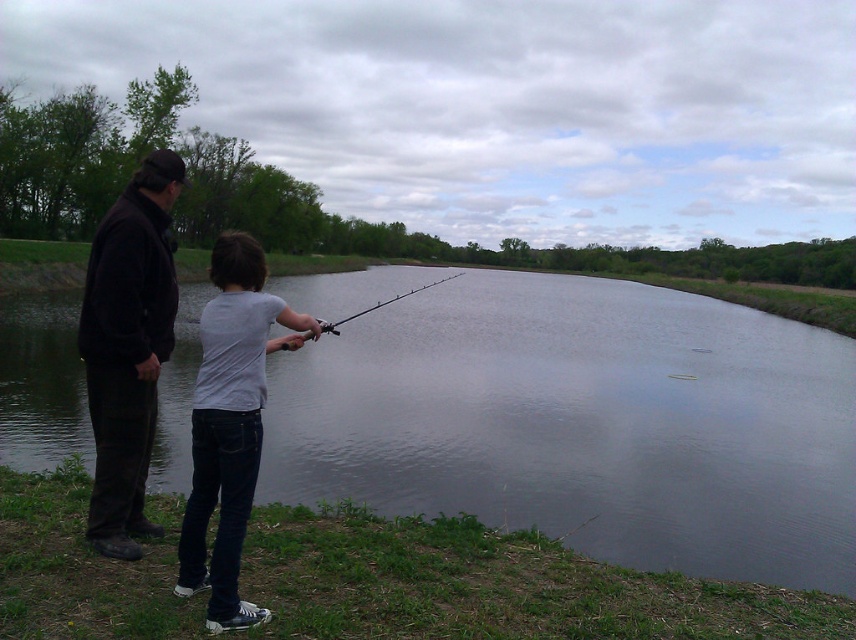
Question: Can you confirm if dark brown leather jacket at left is positioned above white matte shirt at center?

Choices:
 (A) yes
 (B) no

Answer: (A)

Question: Is clear water at center further to camera compared to smooth black rod at center?

Choices:
 (A) no
 (B) yes

Answer: (A)

Question: Which point is farther from the camera taking this photo?

Choices:
 (A) (284, 342)
 (B) (266, 476)

Answer: (B)

Question: Among these points, which one is farthest from the camera?

Choices:
 (A) (397, 296)
 (B) (232, 525)
 (C) (801, 444)
 (D) (141, 275)

Answer: (A)

Question: Estimate the real-world distances between objects in this image. Which object is farther from the smooth black rod at center?

Choices:
 (A) white matte shirt at center
 (B) clear water at center

Answer: (A)

Question: Does clear water at center have a smaller size compared to dark brown leather jacket at left?

Choices:
 (A) no
 (B) yes

Answer: (A)